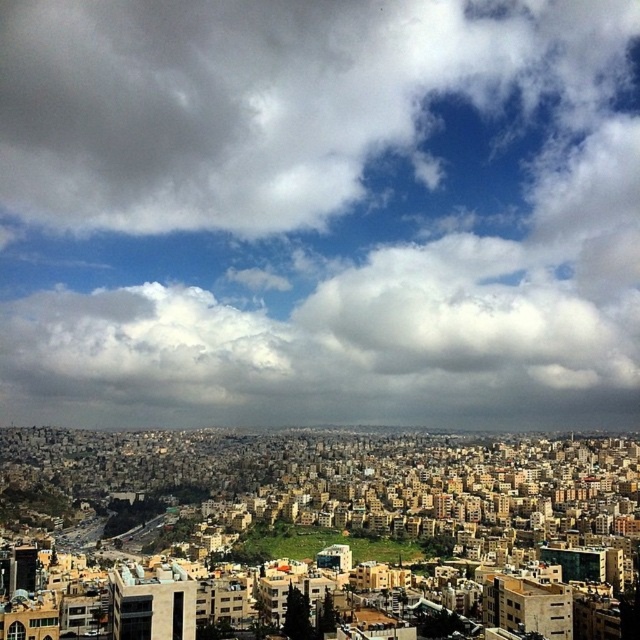
You are standing in the urban area and want to take a photo of the cloudy sky at upper center and the green grassy hill at center. Which object should you point your camera towards first to capture both in the same frame?

You should point your camera towards the cloudy sky at upper center first because it is positioned on the left side of the green grassy hill at center, allowing both to be included in the frame when framing from left to right.

You are standing in the urban area shown in the image. If you look straight ahead, where would you see the cloudy sky at upper center?

The cloudy sky at upper center is located at point (320,212), which means it is positioned one third from the left edge and centered vertically in the image.

You are an architect planning to build a new skyscraper in this urban area. Considering the cloudy sky at upper center and the green grassy hill at center, which object would you need to consider in terms of height for ensuring your building doesn not exceed local zoning regulations?

The cloudy sky at upper center is much taller than the green grassy hill at center, so you should consider the cloudy sky at upper center when planning the height of your skyscraper to comply with zoning regulations.